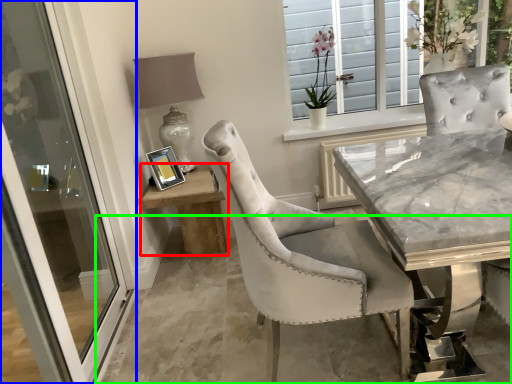
Question: Based on their relative distances, which object is nearer to table (highlighted by a red box)? Choose from door (highlighted by a blue box) and concrete (highlighted by a green box).

Choices:
 (A) door
 (B) concrete

Answer: (B)